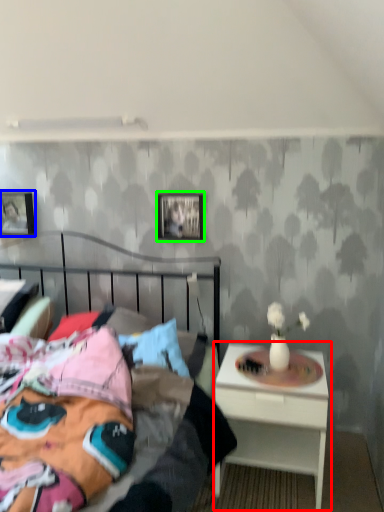
Question: Which object is positioned farthest from nightstand (highlighted by a red box)? Select from picture frame (highlighted by a blue box) and picture frame (highlighted by a green box).

Choices:
 (A) picture frame
 (B) picture frame

Answer: (A)